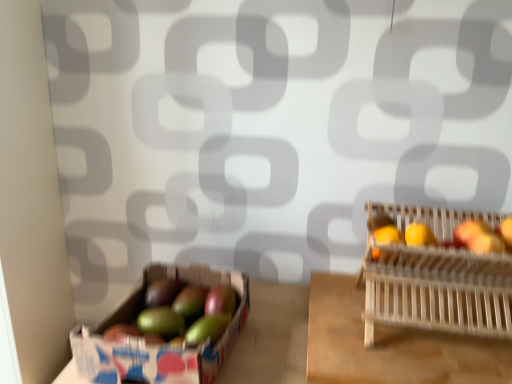
Locate an element on the screen. unoccupied region to the right of green matte mangoes at left is located at coordinates (271, 337).